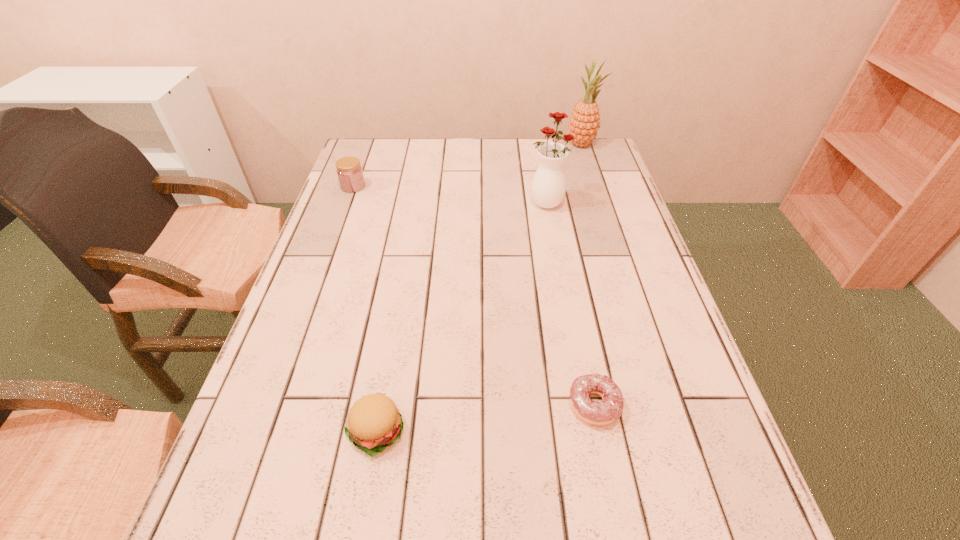
Locate an element on the screen. This screenshot has height=540, width=960. the farthest object is located at coordinates point(584,123).

You are a GUI agent. You are given a task and a screenshot of the screen. Output one action in this format:
    pyautogui.click(x=<x>, y=<y>)
    Task: Click on the pineapple
    
    Given the screenshot: What is the action you would take?
    pyautogui.click(x=584, y=123)

This screenshot has width=960, height=540. In order to click on vase in this screenshot , I will do `click(548, 188)`.

Identify the location of jam. (349, 171).

Find the location of a particular element. This screenshot has height=540, width=960. the third shortest object is located at coordinates click(349, 171).

Identify the location of the fourth tallest object. Image resolution: width=960 pixels, height=540 pixels. click(x=374, y=422).

The height and width of the screenshot is (540, 960). Find the location of `hamburger`. hamburger is located at coordinates pos(374,422).

This screenshot has width=960, height=540. In order to click on doughnut in this screenshot , I will do `click(592, 412)`.

Where is `vacant space situated on the front of the pineapple`? vacant space situated on the front of the pineapple is located at coordinates (596, 186).

I want to click on free space located on the front of the vase, so click(x=566, y=319).